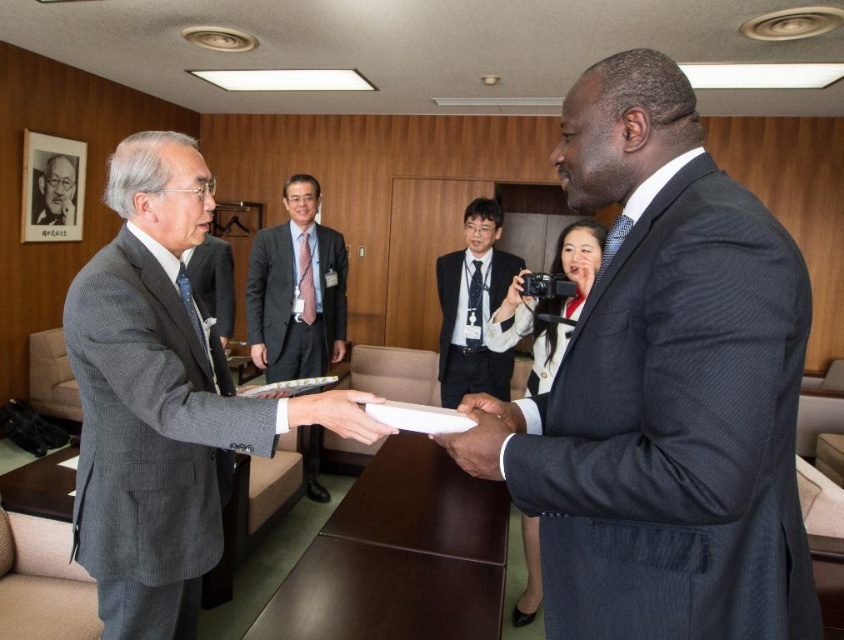
Question: In this image, where is dark blue suit at center located relative to gray wool suit at left?

Choices:
 (A) left
 (B) right

Answer: (B)

Question: Is dark brown leather hand at center positioned behind white matte paper at center?

Choices:
 (A) no
 (B) yes

Answer: (A)

Question: Where is gray wool suit at left located in relation to dark brown leather hand at center in the image?

Choices:
 (A) left
 (B) right

Answer: (A)

Question: Estimate the real-world distances between objects in this image. Which object is farther from the gray wool suit at left?

Choices:
 (A) black matte hand at center
 (B) dark brown leather hand at center
 (C) gray wool suit at center
 (D) matte black camera at center

Answer: (C)

Question: Which point is closer to the camera?

Choices:
 (A) matte gray suit at center
 (B) dark blue suit at center

Answer: (B)

Question: Which of the following is the farthest from the observer?

Choices:
 (A) dark blue suit at center
 (B) matte gray suit at center
 (C) black matte hand at center
 (D) gray wool suit at center

Answer: (D)